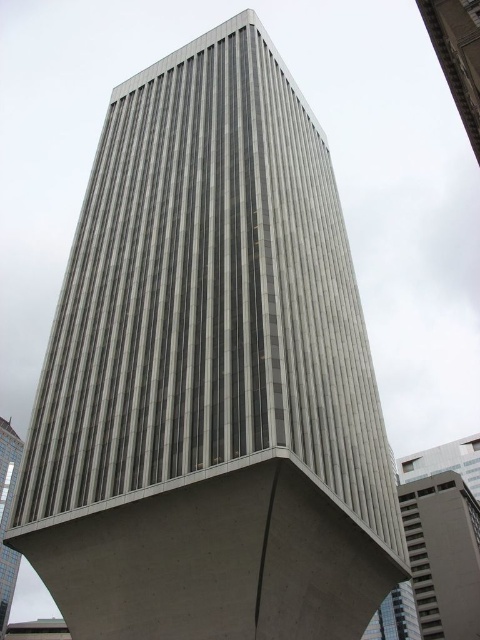
You are a city planner assessing the skyline. You notice the gray concrete building at right and the gray concrete tower at center. Which structure would require more maintenance due to its size?

The gray concrete tower at center requires more maintenance because it is larger than the gray concrete building at right.

You are an architect reviewing a cityscape design. You notice the gray concrete building at right and the gray concrete tower at upper right. Which of these two structures is located to the right of the other?

The gray concrete building at right is positioned on the right side of the gray concrete tower at upper right.

You are standing at the base of the skyscraper and want to take a photo of the point at coordinates point (466,576). Your camera has a maximum focus range of 150 meters. Will the camera be able to focus on the point?

The point (466,576) is 127.70 meters from the camera. Since the maximum focus range is 150 meters, the camera can focus on the point as it is within the range.